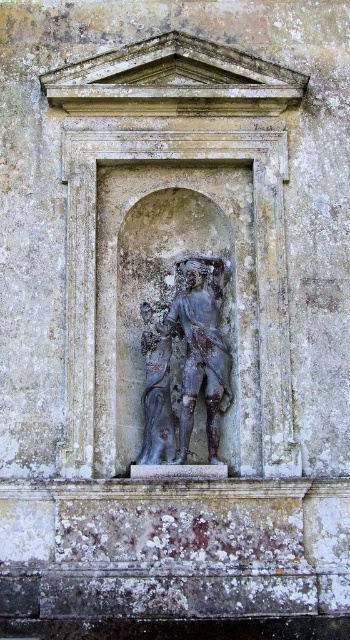
You are an art conservator examining the ancient stone relief sculpture. You notice two statues depicted in the relief. The first is a bronze statue at center, and the second is a dark gray stone statue at center. Which statue is positioned higher up in the relief?

The bronze statue at center is located above the dark gray stone statue at center, so it is positioned higher up in the relief.

You are an archaeologist examining the ancient stone relief sculpture. You notice two points on the relief, labeled as point (211, 264) and point (157, 392). Which point is closer to your eyes?

Point (211, 264) is further to the viewer than point (157, 392), so the point closer to your eyes is point (157, 392).